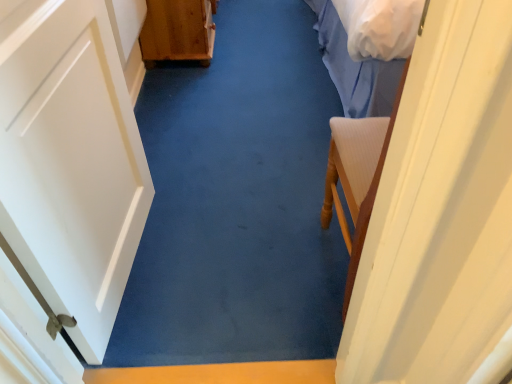
Where is `free space in front of wooden chest at left`? The image size is (512, 384). free space in front of wooden chest at left is located at coordinates (216, 84).